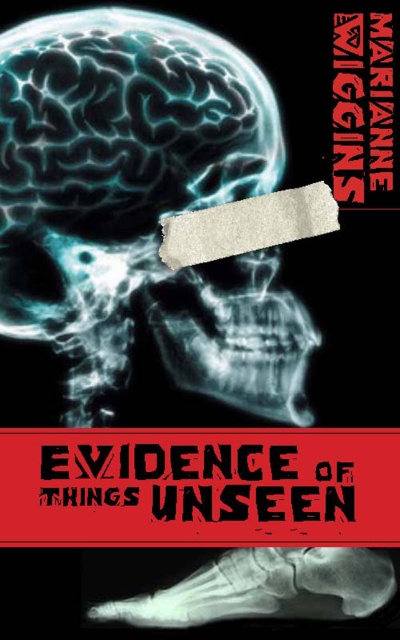
Based on the coordinates provided, which object on the book cover does the point at position (140, 209) align with?

The point at position (140, 209) aligns with the xray skull at center as stated in the objects description.